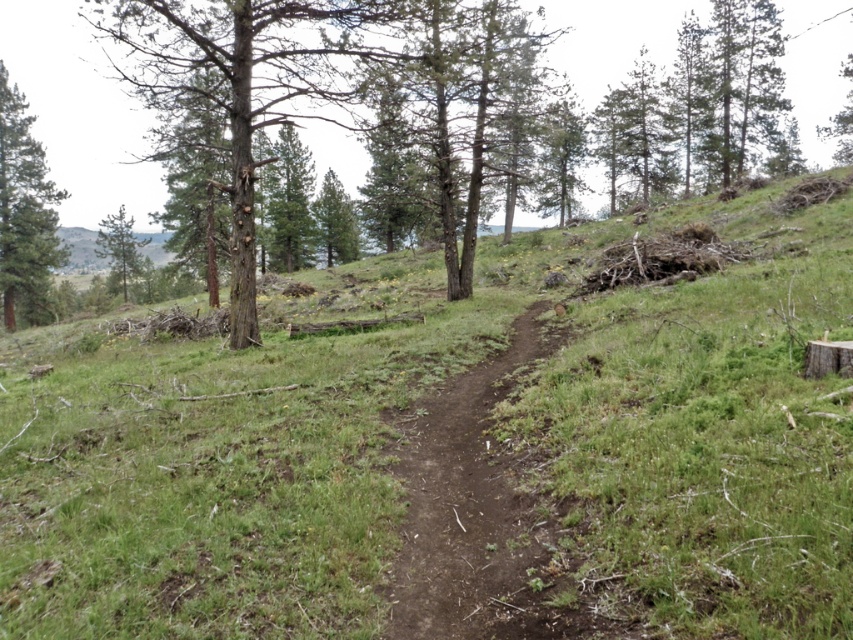
Is brown dirt track at center thinner than green matte tree at upper left?

A: Yes.

Is brown dirt track at center behind green matte tree at upper left?

No, brown dirt track at center is closer to the viewer.

Is point (469, 412) farther from viewer compared to point (103, 252)?

No, it is in front of (103, 252).

I want to click on brown dirt track at center, so click(467, 508).

From the picture: Who is lower down, green grassy at center or brown dirt track at center?

Positioned lower is brown dirt track at center.

Is green grassy at center smaller than brown dirt track at center?

No.

Does point (494, 273) lie behind point (494, 632)?

Yes.

This screenshot has height=640, width=853. Find the location of `green grassy at center`. green grassy at center is located at coordinates (231, 460).

Does point (254, 531) come in front of point (15, 273)?

Yes, it is.

Is green grassy at center wider than green textured pine tree at left?

In fact, green grassy at center might be narrower than green textured pine tree at left.

Is point (187, 460) closer to camera compared to point (51, 198)?

Yes, it is in front of point (51, 198).

Locate an element on the screen. green grassy at center is located at coordinates (231, 460).